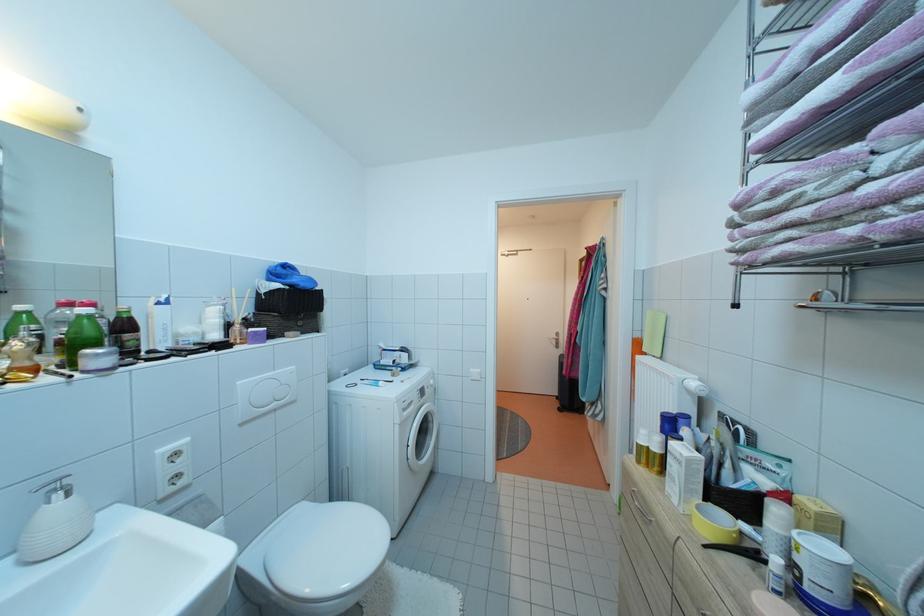
Find the location of `large flush button`. large flush button is located at coordinates (265, 392).